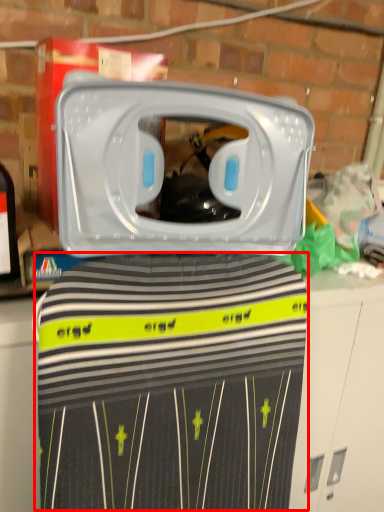
Question: From the image's perspective, where is clothing (annotated by the red box) located in relation to home appliance in the image?

Choices:
 (A) above
 (B) below

Answer: (B)